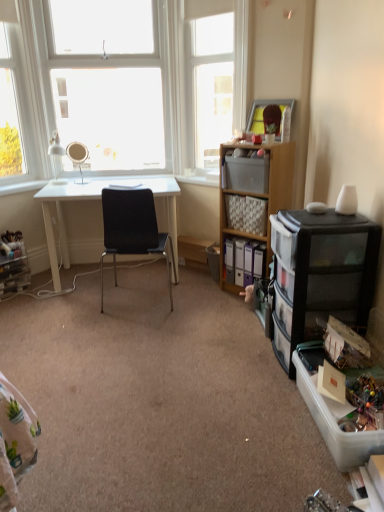
Locate an element on the screen. The height and width of the screenshot is (512, 384). vacant space to the right of black mesh chair at center is located at coordinates (202, 308).